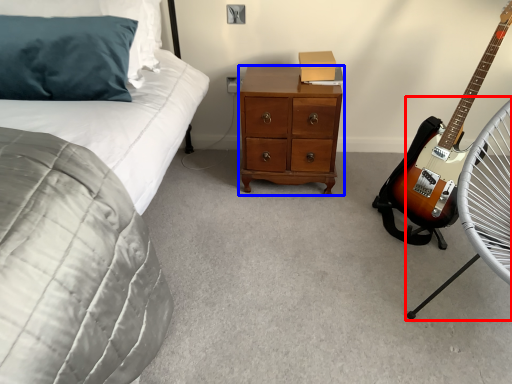
Question: Which of the following is the farthest to the observer, folding chair (highlighted by a red box) or chest of drawers (highlighted by a blue box)?

Choices:
 (A) folding chair
 (B) chest of drawers

Answer: (B)